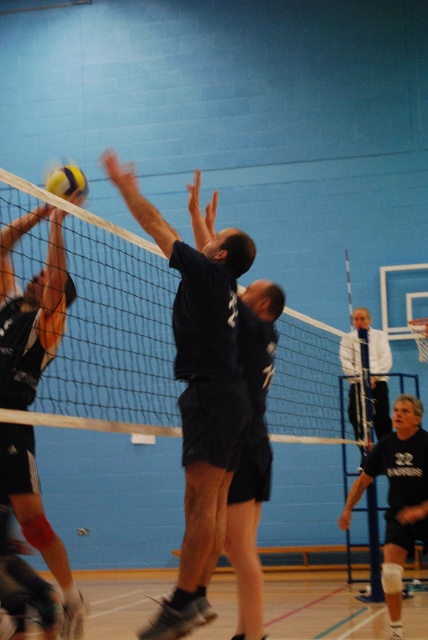
Is matte black shorts at center positioned behind yellowmaterial/texturevolleyball at upper left?

No, it is in front of yellowmaterial/texturevolleyball at upper left.

Measure the distance between matte black shorts at center and camera.

They are 4.40 meters apart.

Which is in front, point (65, 304) or point (77, 186)?

Positioned in front is point (65, 304).

What are the coordinates of `matte black shorts at center` in the screenshot? It's located at point(30,308).

Between point (419, 426) and point (80, 179), which one is positioned behind?

Positioned behind is point (419, 426).

Is black matte shorts at center shorter than yellowmaterial/texturevolleyball at upper left?

No.

You are a GUI agent. You are given a task and a screenshot of the screen. Output one action in this format:
    pyautogui.click(x=<x>, y=<y>)
    Task: Click on the black matte shorts at center
    Image resolution: width=428 pixels, height=640 pixels.
    Given the screenshot: What is the action you would take?
    [398, 497]

Is dark blue jersey at center thinner than white fabric shirt at upper center?

Indeed, dark blue jersey at center has a lesser width compared to white fabric shirt at upper center.

Is dark blue jersey at center in front of white fabric shirt at upper center?

Yes, dark blue jersey at center is in front of white fabric shirt at upper center.

Is point (192, 444) closer to camera compared to point (353, 371)?

That is True.

At what (x,y) coordinates should I click in order to perform the action: click on dark blue jersey at center. Please return your answer as a coordinate pair (x, y). The height and width of the screenshot is (640, 428). Looking at the image, I should click on (199, 392).